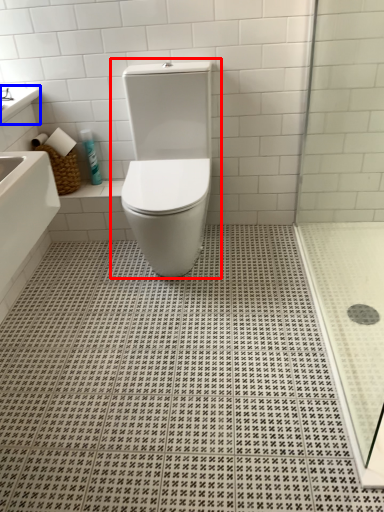
Question: Which object appears closest to the camera in this image, toilet (highlighted by a red box) or counter top (highlighted by a blue box)?

Choices:
 (A) toilet
 (B) counter top

Answer: (A)